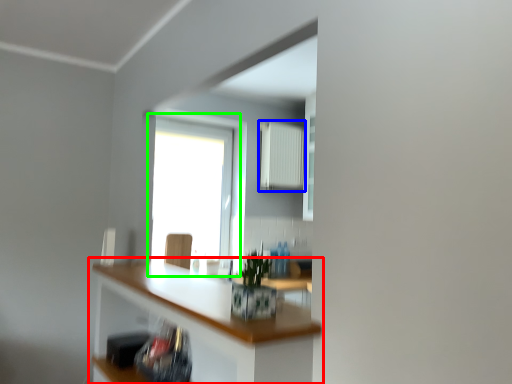
Question: Which object is positioned closest to countertop (highlighted by a red box)? Select from radiator (highlighted by a blue box) and window (highlighted by a green box).

Choices:
 (A) radiator
 (B) window

Answer: (B)